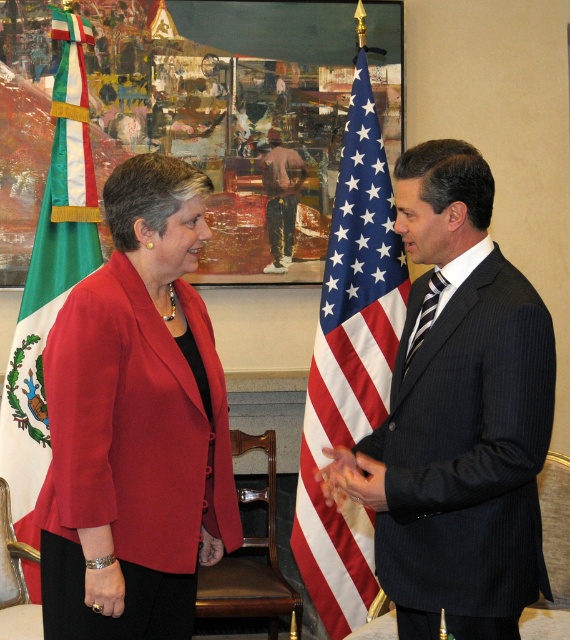
Question: Which point appears farthest from the camera in this image?

Choices:
 (A) (469, 616)
 (B) (104, 611)

Answer: (B)

Question: Can you confirm if american flag at center is smaller than pink cotton shirt at center?

Choices:
 (A) yes
 (B) no

Answer: (B)

Question: In this image, where is pink cotton shirt at center located relative to smooth skin hand at center?

Choices:
 (A) below
 (B) above

Answer: (B)

Question: Which of the following is the closest to the observer?

Choices:
 (A) matte red blazer at center
 (B) pink cotton shirt at center
 (C) dark blue pinstripe suit at center

Answer: (C)

Question: Which of the following is the farthest from the observer?

Choices:
 (A) (367, 460)
 (B) (133, 218)
 (C) (80, 19)
 (D) (515, 556)

Answer: (C)

Question: Considering the relative positions of american flag at center and smooth skin hand at center in the image provided, where is american flag at center located with respect to smooth skin hand at center?

Choices:
 (A) right
 (B) left

Answer: (A)